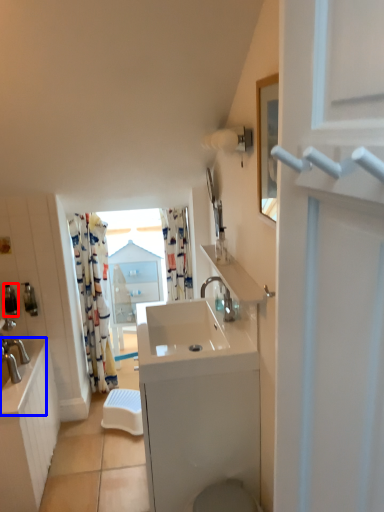
Question: Which point is further to the camera, toiletry (highlighted by a red box) or counter top (highlighted by a blue box)?

Choices:
 (A) toiletry
 (B) counter top

Answer: (A)